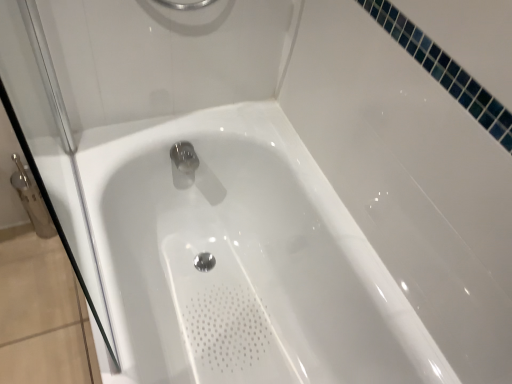
Question: Is white glossy bathtub at center in front of transparent glass shower door at left?

Choices:
 (A) yes
 (B) no

Answer: (B)

Question: Is the depth of white glossy bathtub at center greater than that of transparent glass shower door at left?

Choices:
 (A) yes
 (B) no

Answer: (A)

Question: Is white glossy bathtub at center beside transparent glass shower door at left?

Choices:
 (A) yes
 (B) no

Answer: (B)

Question: Does white glossy bathtub at center have a lesser height compared to transparent glass shower door at left?

Choices:
 (A) yes
 (B) no

Answer: (A)

Question: Is transparent glass shower door at left located within white glossy bathtub at center?

Choices:
 (A) yes
 (B) no

Answer: (B)

Question: Is white glossy bathtub at center located outside transparent glass shower door at left?

Choices:
 (A) no
 (B) yes

Answer: (B)

Question: Does transparent glass shower door at left come behind white glossy bathtub at center?

Choices:
 (A) yes
 (B) no

Answer: (B)

Question: Considering the relative sizes of transparent glass shower door at left and white glossy bathtub at center in the image provided, is transparent glass shower door at left bigger than white glossy bathtub at center?

Choices:
 (A) no
 (B) yes

Answer: (A)

Question: Can you confirm if transparent glass shower door at left is positioned to the left of white glossy bathtub at center?

Choices:
 (A) no
 (B) yes

Answer: (B)

Question: Is transparent glass shower door at left positioned before white glossy bathtub at center?

Choices:
 (A) yes
 (B) no

Answer: (A)

Question: Is transparent glass shower door at left not near white glossy bathtub at center?

Choices:
 (A) yes
 (B) no

Answer: (B)

Question: Does transparent glass shower door at left have a greater height compared to white glossy bathtub at center?

Choices:
 (A) no
 (B) yes

Answer: (B)

Question: Considering the positions of transparent glass shower door at left and white glossy bathtub at center in the image, is transparent glass shower door at left bigger or smaller than white glossy bathtub at center?

Choices:
 (A) big
 (B) small

Answer: (B)